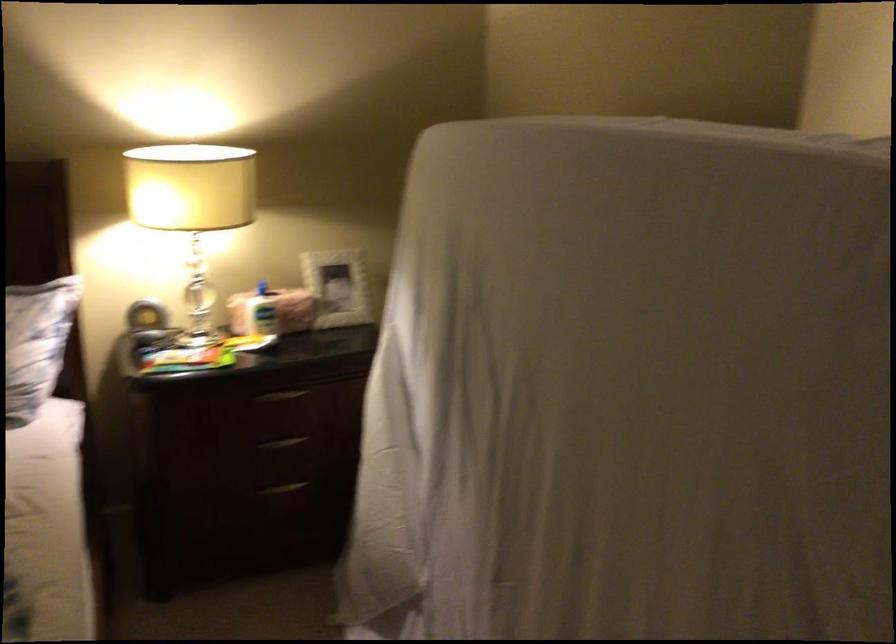
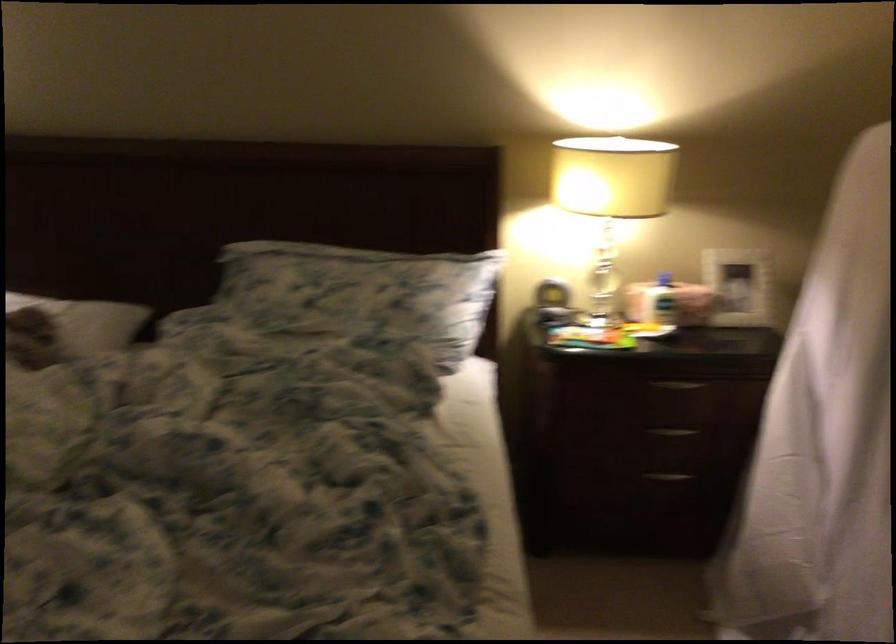
Where in the second image is the point corresponding to [332,292] from the first image?

(737, 286)